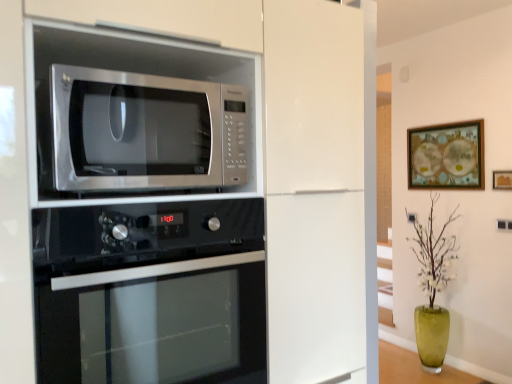
What do you see at coordinates (446, 156) in the screenshot? The width and height of the screenshot is (512, 384). I see `wooden framed artwork at upper right, the 2th picture frame from the right` at bounding box center [446, 156].

Identify the location of wooden framed artwork at upper right, which is the first picture frame from back to front. (446, 156).

This screenshot has width=512, height=384. Describe the element at coordinates (502, 180) in the screenshot. I see `wooden framed picture at upper right, the 2th picture frame positioned from the back` at that location.

Measure the distance between point (x=247, y=180) and camera.

The depth of point (x=247, y=180) is 1.21 meters.

You are a GUI agent. You are given a task and a screenshot of the screen. Output one action in this format:
    pyautogui.click(x=<x>, y=<y>)
    Task: Click on the satin white oven at upper left
    
    Given the screenshot: What is the action you would take?
    pyautogui.click(x=195, y=199)

Find the location of a particular element. Image resolution: width=512 pixels, height=384 pixels. green glass vase at lower right is located at coordinates (415, 369).

What is the approximate width of green glass vase at lower right?

It is 1.39 inches.

What do you see at coordinates (150, 293) in the screenshot? I see `black glass oven at lower center` at bounding box center [150, 293].

Find the location of a particular element. The image size is (512, 384). stainless steel microwave at upper left is located at coordinates (146, 131).

You are a GUI agent. You are given a task and a screenshot of the screen. Output one action in this format:
    pyautogui.click(x=<x>, y=<y>)
    Task: Click on the wooden framed artwork at upper right, which is the first picture frame from back to front
    
    Given the screenshot: What is the action you would take?
    pyautogui.click(x=446, y=156)

Based on the photo, between stainless steel microwave at upper left and black glass oven at lower center, which one has smaller size?

stainless steel microwave at upper left is smaller.

Considering the positions of points (84, 124) and (37, 227), is point (84, 124) closer to camera compared to point (37, 227)?

No, it is behind (37, 227).

Is stainless steel microwave at upper left next to black glass oven at lower center?

No, stainless steel microwave at upper left is not in contact with black glass oven at lower center.

Locate an element on the screen. This screenshot has height=384, width=512. microwave oven on the left of black glass oven at lower center is located at coordinates (146, 131).

Considering the sizes of green glass vase at lower right and wooden framed artwork at upper right, which is the first picture frame from back to front, in the image, is green glass vase at lower right wider or thinner than wooden framed artwork at upper right, which is the first picture frame from back to front,?

green glass vase at lower right is wider than wooden framed artwork at upper right, which is the first picture frame from back to front.

Is green glass vase at lower right looking in the opposite direction of wooden framed artwork at upper right, the 2th picture frame from the right?

No, green glass vase at lower right's orientation is not away from wooden framed artwork at upper right, the 2th picture frame from the right.

Which object is positioned more to the left, green glass vase at lower right or wooden framed artwork at upper right, which is counted as the second picture frame, starting from the front?

green glass vase at lower right is more to the left.

Based on the photo, does green glass vase at lower right come behind wooden framed artwork at upper right, which is the first picture frame from back to front?

No, green glass vase at lower right is in front of wooden framed artwork at upper right, which is the first picture frame from back to front.

From the image's perspective, which one is positioned lower, stainless steel microwave at upper left or green glass vase at lower right?

From the image's view, green glass vase at lower right is below.

From a real-world perspective, between stainless steel microwave at upper left and green glass vase at lower right, who is vertically lower?

In real-world perspective, green glass vase at lower right is lower.

Does stainless steel microwave at upper left appear on the left side of green glass vase at lower right?

Indeed, stainless steel microwave at upper left is positioned on the left side of green glass vase at lower right.

Can you tell me how much stainless steel microwave at upper left and green glass vase at lower right differ in facing direction?

They differ by 89.8 degrees in their facing directions.

From the image's perspective, which is above, wooden framed artwork at upper right, which is the first picture frame from back to front, or green glass vase at lower right?

From the image's view, wooden framed artwork at upper right, which is the first picture frame from back to front, is above.

From the image's perspective, count 2nd picture frames upward from the green glass vase at lower right and point to it. Please provide its 2D coordinates.

[(446, 156)]

Is wooden framed artwork at upper right, which is counted as the second picture frame, starting from the front, positioned far away from green glass vase at lower right?

Yes, wooden framed artwork at upper right, which is counted as the second picture frame, starting from the front, and green glass vase at lower right are quite far apart.

From a real-world perspective, is wooden framed artwork at upper right, acting as the first picture frame starting from the left, positioned above or below green glass vase at lower right?

wooden framed artwork at upper right, acting as the first picture frame starting from the left, is situated higher than green glass vase at lower right in the real world.

How distant is stainless steel microwave at upper left from wooden framed artwork at upper right, which is the first picture frame from back to front?

8.86 feet.

From the image's perspective, which object appears higher, stainless steel microwave at upper left or wooden framed artwork at upper right, which is the first picture frame from back to front?

wooden framed artwork at upper right, which is the first picture frame from back to front.

Consider the image. Would you say stainless steel microwave at upper left is outside wooden framed artwork at upper right, which is the first picture frame from back to front?

Yes, stainless steel microwave at upper left is located beyond the bounds of wooden framed artwork at upper right, which is the first picture frame from back to front.

Could you tell me if stainless steel microwave at upper left is facing wooden framed artwork at upper right, which is the first picture frame from back to front?

No.

Considering the relative sizes of black glass oven at lower center and satin white oven at upper left in the image provided, is black glass oven at lower center shorter than satin white oven at upper left?

Yes, black glass oven at lower center is shorter than satin white oven at upper left.

From the image's perspective, between black glass oven at lower center and satin white oven at upper left, which one is located above?

satin white oven at upper left is shown above in the image.

From a real-world perspective, is black glass oven at lower center beneath satin white oven at upper left?

Yes.

Visually, is black glass oven at lower center positioned to the left or to the right of satin white oven at upper left?

black glass oven at lower center is to the right of satin white oven at upper left.

Are satin white oven at upper left and black glass oven at lower center far apart?

satin white oven at upper left is near black glass oven at lower center, not far away.

Based on the photo, which object is positioned more to the left, satin white oven at upper left or black glass oven at lower center?

From the viewer's perspective, satin white oven at upper left appears more on the left side.

From their relative heights in the image, would you say satin white oven at upper left is taller or shorter than black glass oven at lower center?

In the image, satin white oven at upper left appears to be taller than black glass oven at lower center.

This screenshot has height=384, width=512. I want to click on cabinetry that is above the black glass oven at lower center (from a real-world perspective), so click(x=195, y=199).

Find the location of a particular element. The image size is (512, 384). microwave oven above the black glass oven at lower center (from the image's perspective) is located at coordinates (146, 131).

Where is `picture frame behind the green glass vase at lower right`? picture frame behind the green glass vase at lower right is located at coordinates (446, 156).

From the image, which object appears to be nearer to satin white oven at upper left, green glass vase at lower right or wooden framed artwork at upper right, which is counted as the second picture frame, starting from the front?

green glass vase at lower right lies closer to satin white oven at upper left than the other object.

Looking at the image, which one is located closer to satin white oven at upper left, wooden framed artwork at upper right, which is counted as the second picture frame, starting from the front, or green glass vase at lower right?

green glass vase at lower right is closer to satin white oven at upper left.

From the image, which object appears to be nearer to stainless steel microwave at upper left, wooden framed picture at upper right, positioned as the 1th picture frame in front-to-back order, or green glass vase at lower right?

wooden framed picture at upper right, positioned as the 1th picture frame in front-to-back order, is positioned closer to the anchor stainless steel microwave at upper left.

Based on their spatial positions, is satin white oven at upper left or stainless steel microwave at upper left further from wooden framed artwork at upper right, the 2th picture frame from the right?

Among the two, stainless steel microwave at upper left is located further to wooden framed artwork at upper right, the 2th picture frame from the right.

Estimate the real-world distances between objects in this image. Which object is further from wooden framed picture at upper right, positioned as the 1th picture frame in front-to-back order, satin white oven at upper left or stainless steel microwave at upper left?

stainless steel microwave at upper left is further to wooden framed picture at upper right, positioned as the 1th picture frame in front-to-back order.

When comparing their distances from stainless steel microwave at upper left, does green glass vase at lower right or wooden framed artwork at upper right, which is counted as the second picture frame, starting from the front, seem closer?

wooden framed artwork at upper right, which is counted as the second picture frame, starting from the front.

Based on their spatial positions, is stainless steel microwave at upper left or wooden framed picture at upper right, the 2th picture frame positioned from the back, closer to wooden framed artwork at upper right, which is counted as the second picture frame, starting from the front?

wooden framed picture at upper right, the 2th picture frame positioned from the back.

Estimate the real-world distances between objects in this image. Which object is closer to wooden framed artwork at upper right, which is the first picture frame from back to front, wooden framed picture at upper right, the first picture frame when ordered from right to left, or green glass vase at lower right?

Among the two, wooden framed picture at upper right, the first picture frame when ordered from right to left, is located nearer to wooden framed artwork at upper right, which is the first picture frame from back to front.

Locate an element on the screen. This screenshot has height=384, width=512. microwave oven between satin white oven at upper left and wooden framed artwork at upper right, the 2th picture frame from the right, in the front-back direction is located at coordinates (146, 131).

What are the coordinates of `picture frame between satin white oven at upper left and wooden framed artwork at upper right, acting as the first picture frame starting from the left, along the z-axis` in the screenshot? It's located at (502, 180).

I want to click on microwave oven between black glass oven at lower center and wooden framed artwork at upper right, acting as the first picture frame starting from the left, along the z-axis, so click(x=146, y=131).

Locate an element on the screen. This screenshot has height=384, width=512. microwave oven between black glass oven at lower center and green glass vase at lower right from front to back is located at coordinates (146, 131).